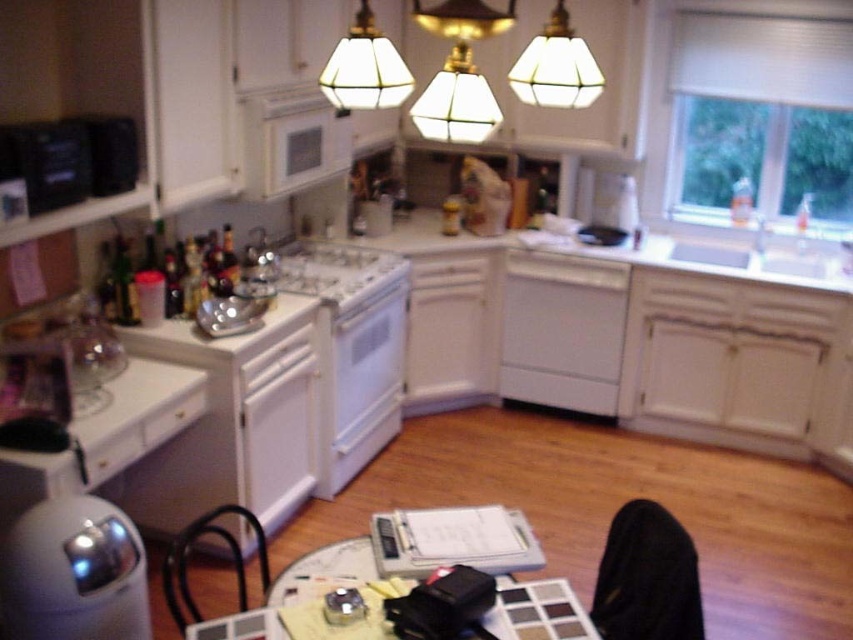
Is matte glass lampshade at upper center taller than translucent glass lampshade at upper center?

Yes, matte glass lampshade at upper center is taller than translucent glass lampshade at upper center.

Which of these two, matte glass lampshade at upper center or translucent glass lampshade at upper center, stands shorter?

translucent glass lampshade at upper center

Does point (345, 100) lie behind point (570, 93)?

No, (345, 100) is closer to viewer.

This screenshot has width=853, height=640. I want to click on matte glass lampshade at upper center, so click(364, 68).

Between white glossy countertop at center and white glossy microwave at upper center, which one appears on the left side from the viewer's perspective?

white glossy microwave at upper center

Is point (749, 269) less distant than point (244, 180)?

No.

The height and width of the screenshot is (640, 853). Identify the location of white glossy countertop at center. (630, 252).

Identify the location of white glossy countertop at center. Image resolution: width=853 pixels, height=640 pixels. (630, 252).

Does white glossy stove at center have a smaller size compared to translucent glass lampshade at upper center?

Actually, white glossy stove at center might be larger than translucent glass lampshade at upper center.

Is the position of white glossy stove at center more distant than that of translucent glass lampshade at upper center?

Yes.

This screenshot has height=640, width=853. What do you see at coordinates (351, 348) in the screenshot?
I see `white glossy stove at center` at bounding box center [351, 348].

The height and width of the screenshot is (640, 853). Find the location of `white glossy stove at center`. white glossy stove at center is located at coordinates (351, 348).